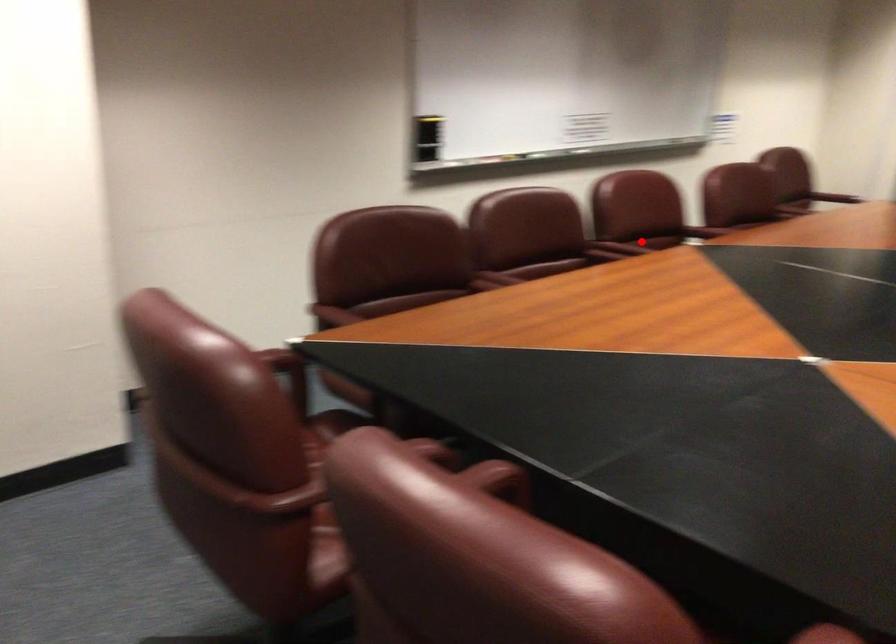
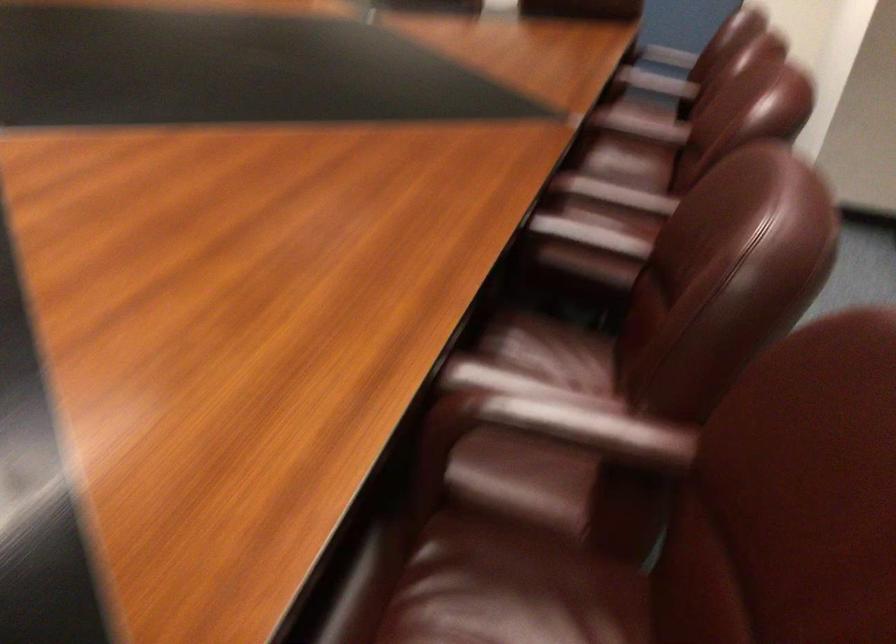
Question: A red point is marked in image1. In image2, is the corresponding 3D point closer to the camera or farther? Reply with the corresponding letter.

Choices:
 (A) The corresponding 3D point is closer.
 (B) The corresponding 3D point is farther.

Answer: (A)